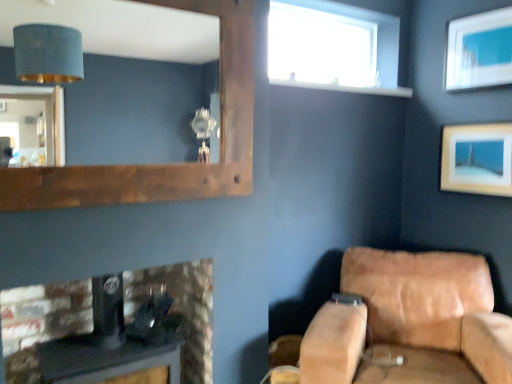
Question: Considering the relative positions of tan leather couch at lower right and wooden picture frame at upper right, which is the 1th picture frame from bottom to top, in the image provided, is tan leather couch at lower right to the left or to the right of wooden picture frame at upper right, which is the 1th picture frame from bottom to top,?

Choices:
 (A) right
 (B) left

Answer: (B)

Question: From the image's perspective, is tan leather couch at lower right positioned above or below wooden picture frame at upper right, which is the 1th picture frame from bottom to top?

Choices:
 (A) above
 (B) below

Answer: (B)

Question: Estimate the real-world distances between objects in this image. Which object is closer to the wooden picture frame at upper right, which is the 1th picture frame from bottom to top?

Choices:
 (A) transparent glass window at upper center
 (B) matte white picture frame at upper right, which is the 1th picture frame in top-to-bottom order
 (C) black leather speaker at lower left
 (D) tan leather couch at lower right
 (E) brown wooden mirror at upper left

Answer: (B)

Question: Which is nearer to the black leather speaker at lower left?

Choices:
 (A) transparent glass window at upper center
 (B) brown wooden mirror at upper left
 (C) matte white picture frame at upper right, arranged as the 2th picture frame when ordered from the bottom
 (D) tan leather couch at lower right
 (E) wooden picture frame at upper right, the 2th picture frame from the top

Answer: (D)